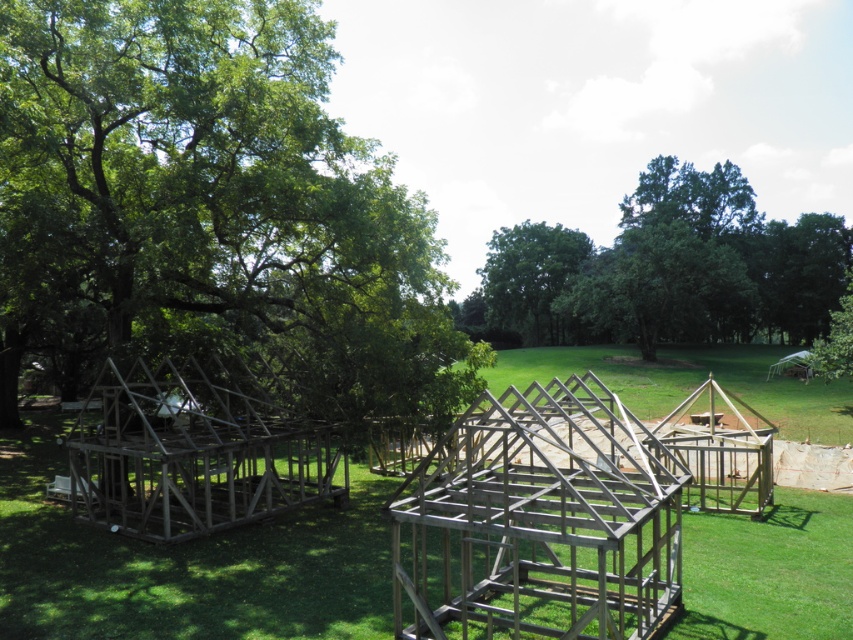
Question: Among these points, which one is farthest from the camera?

Choices:
 (A) [x=544, y=358]
 (B) [x=642, y=221]
 (C) [x=134, y=22]

Answer: (B)

Question: Is green leafy tree at left above green leafy tree at center?

Choices:
 (A) no
 (B) yes

Answer: (A)

Question: Which of the following is the farthest from the observer?

Choices:
 (A) (828, 244)
 (B) (828, 394)

Answer: (A)

Question: Which is nearer to the green leafy tree at left?

Choices:
 (A) wooden frame at center
 (B) green leafy tree at upper center
 (C) green leafy tree at upper right

Answer: (A)

Question: Is green leafy tree at left positioned at the back of green leafy tree at center?

Choices:
 (A) yes
 (B) no

Answer: (B)

Question: Observing the image, what is the correct spatial positioning of wooden frame at center in reference to green leafy tree at center?

Choices:
 (A) below
 (B) above

Answer: (A)